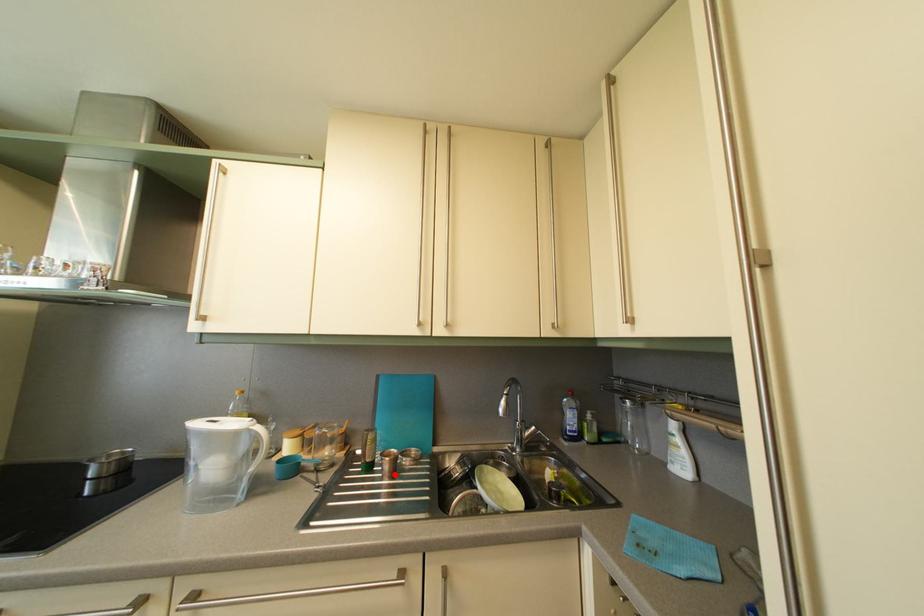
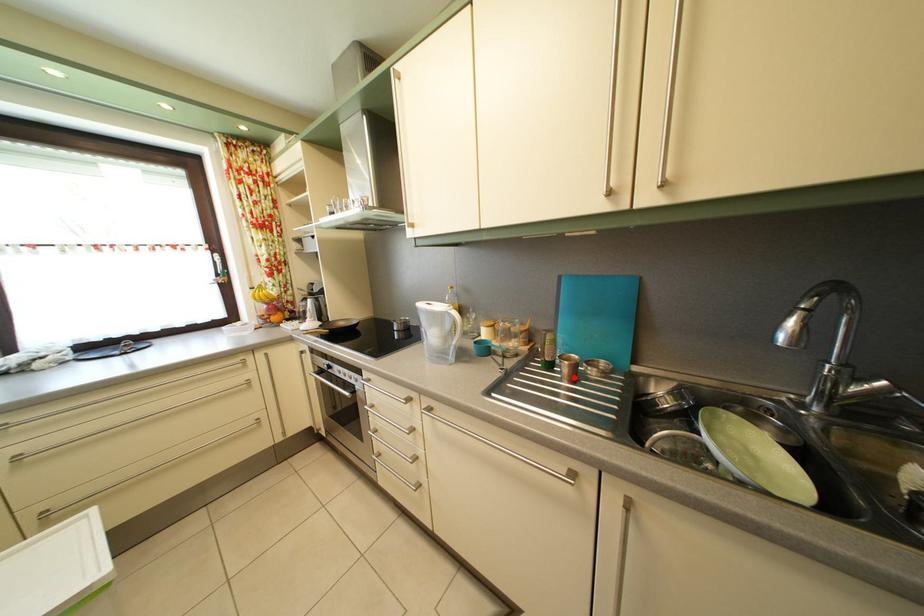
I am providing you with two images of the same scene from different viewpoints. A red point is marked on the first image and another point is marked on the second image. Is the red point in image1 aligned with the point shown in image2?

Yes